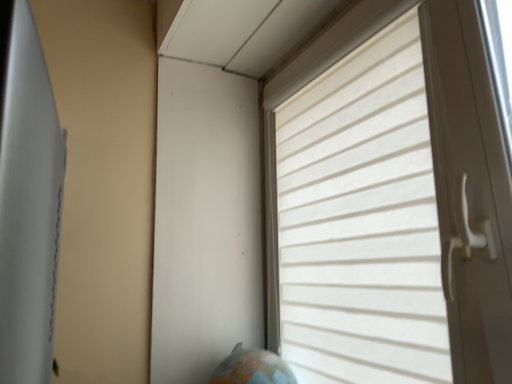
Where is `white matte blinds at right`? white matte blinds at right is located at coordinates (390, 202).

The image size is (512, 384). What do you see at coordinates (390, 202) in the screenshot? I see `white matte blinds at right` at bounding box center [390, 202].

Where is `white matte blinds at right`? Image resolution: width=512 pixels, height=384 pixels. white matte blinds at right is located at coordinates (390, 202).